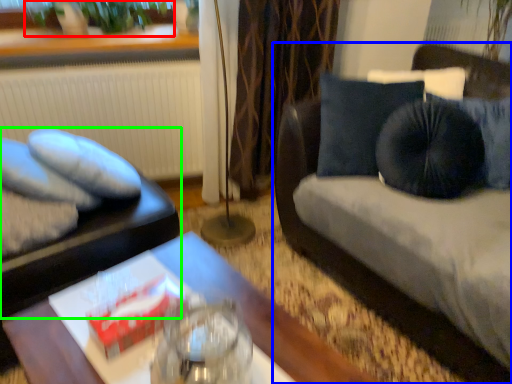
Question: Based on their relative distances, which object is nearer to plant (highlighted by a red box)? Choose from studio couch (highlighted by a blue box) and furniture (highlighted by a green box).

Choices:
 (A) studio couch
 (B) furniture

Answer: (B)